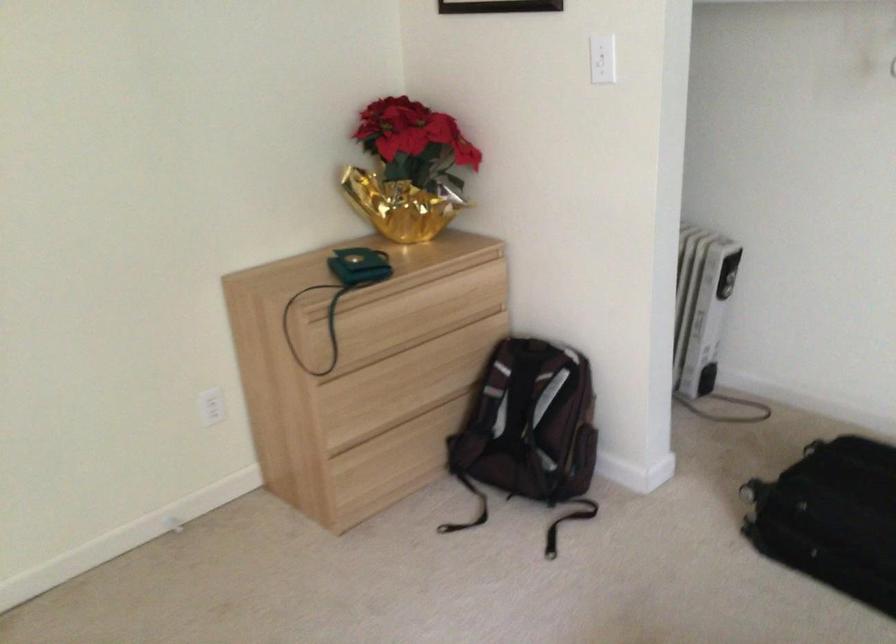
Locate an element on the screen. The height and width of the screenshot is (644, 896). middle drawer pull is located at coordinates (366, 397).